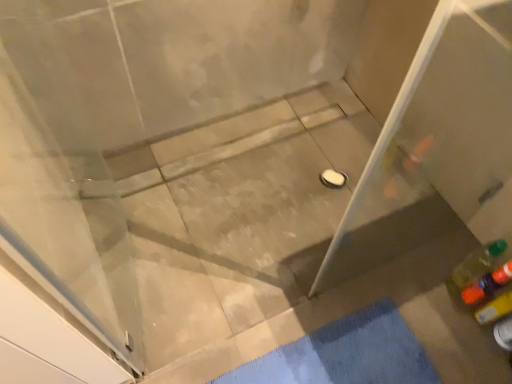
Identify the location of vacant area situated to the left side of translucent plastic bottle at lower right. This screenshot has height=384, width=512. (424, 294).